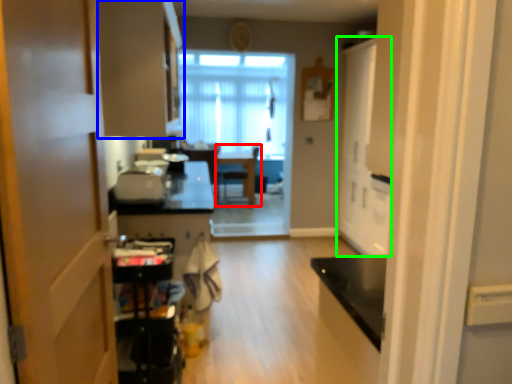
Question: Considering the real-world distances, which object is farthest from chair (highlighted by a red box)? cabinetry (highlighted by a blue box) or door (highlighted by a green box)?

Choices:
 (A) cabinetry
 (B) door

Answer: (A)